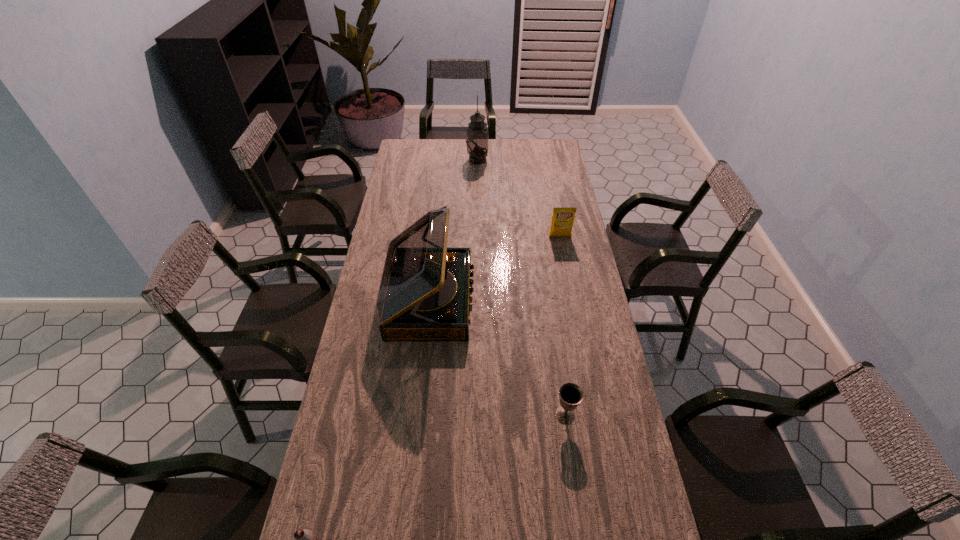
You are a GUI agent. You are given a task and a screenshot of the screen. Output one action in this format:
    pyautogui.click(x=<x>, y=<y>)
    Task: Click on the free location that satisfies the following two spatial constraints: 1. on the front of the rightmost object with the logo; 2. on the front-facing side of the fourth shortest object
    This screenshot has width=960, height=540.
    Given the screenshot: What is the action you would take?
    pyautogui.click(x=572, y=300)

Image resolution: width=960 pixels, height=540 pixels. What are the coordinates of `free space that satisfies the following two spatial constraints: 1. on the front-facing side of the second tallest object; 2. on the right side of the chalice` in the screenshot? It's located at (418, 416).

Identify the location of vacant area in the image that satisfies the following two spatial constraints: 1. on the front-facing side of the fourth farthest object; 2. on the left side of the record player. (418, 416).